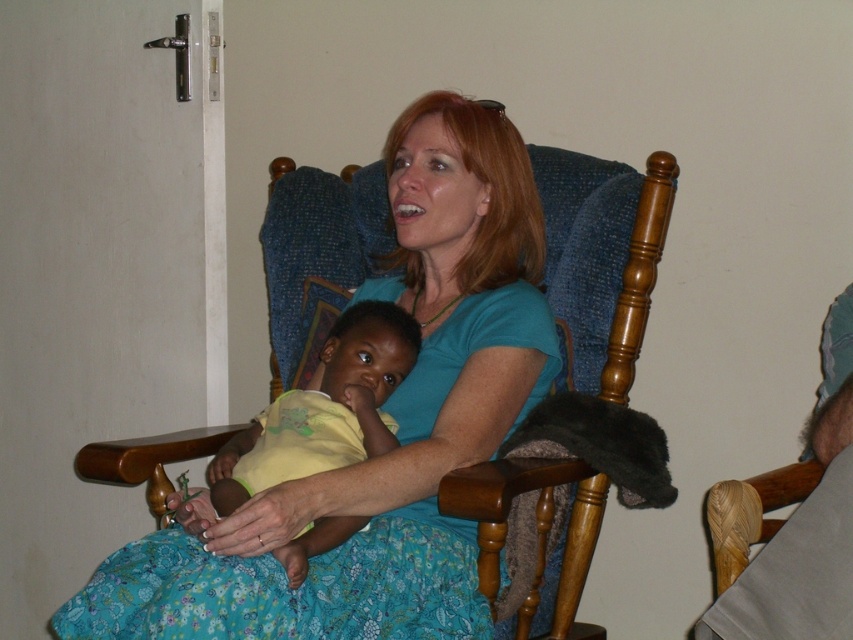
Is blue cotton shirt at center positioned before yellow matte baby at center?

That is True.

Is point (535, 214) closer to viewer compared to point (376, 332)?

No, (535, 214) is behind (376, 332).

This screenshot has height=640, width=853. In order to click on blue cotton shirt at center in this screenshot , I will do `click(392, 416)`.